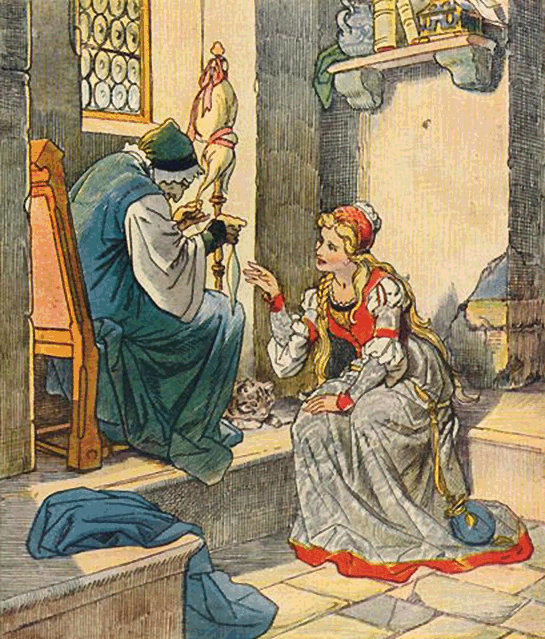
I want to click on walls, so click(x=428, y=203), click(x=236, y=38).